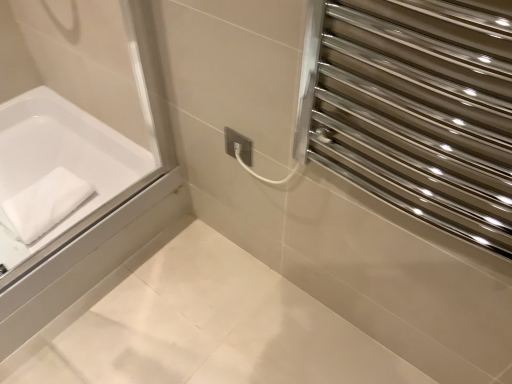
Question: Is white soft towel at left spatially inside polished stainless steel towel rack at upper right, or outside of it?

Choices:
 (A) outside
 (B) inside

Answer: (A)

Question: Looking at their shapes, would you say white soft towel at left is wider or thinner than polished stainless steel towel rack at upper right?

Choices:
 (A) thin
 (B) wide

Answer: (B)

Question: Which is farther from the polished stainless steel towel rack at upper right?

Choices:
 (A) white soft towel at left
 (B) white matte bathtub at left

Answer: (A)

Question: Based on their relative distances, which object is farther from the polished stainless steel towel rack at upper right?

Choices:
 (A) white soft towel at left
 (B) white matte bathtub at left

Answer: (A)